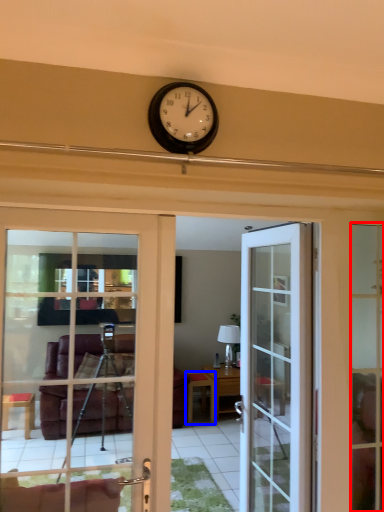
Question: Which point is closer to the camera, window frame (highlighted by a red box) or table (highlighted by a blue box)?

Choices:
 (A) window frame
 (B) table

Answer: (A)